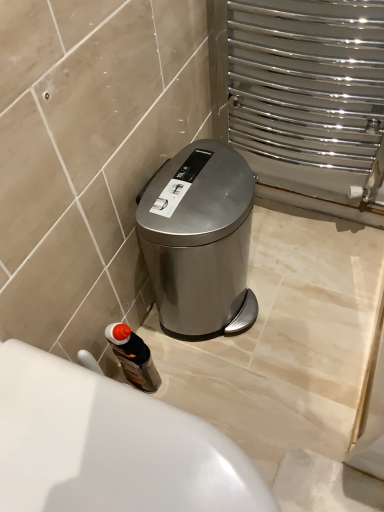
Question: Is white glossy bath at lower left next to satin silver trash can at center and touching it?

Choices:
 (A) no
 (B) yes

Answer: (A)

Question: From the image's perspective, is white glossy bath at lower left located beneath satin silver trash can at center?

Choices:
 (A) yes
 (B) no

Answer: (A)

Question: Is satin silver trash can at center inside white glossy bath at lower left?

Choices:
 (A) yes
 (B) no

Answer: (B)

Question: Is white glossy bath at lower left oriented away from satin silver trash can at center?

Choices:
 (A) yes
 (B) no

Answer: (B)

Question: Is white glossy bath at lower left completely or partially outside of satin silver trash can at center?

Choices:
 (A) yes
 (B) no

Answer: (A)

Question: Does white glossy bath at lower left have a lesser height compared to satin silver trash can at center?

Choices:
 (A) no
 (B) yes

Answer: (B)

Question: From a real-world perspective, is satin silver trash can at center below wooden textured bottle at lower left?

Choices:
 (A) no
 (B) yes

Answer: (A)

Question: Is satin silver trash can at center thinner than wooden textured bottle at lower left?

Choices:
 (A) no
 (B) yes

Answer: (A)

Question: Is satin silver trash can at center positioned far away from wooden textured bottle at lower left?

Choices:
 (A) yes
 (B) no

Answer: (B)

Question: Is satin silver trash can at center further to camera compared to wooden textured bottle at lower left?

Choices:
 (A) no
 (B) yes

Answer: (A)

Question: Does satin silver trash can at center touch wooden textured bottle at lower left?

Choices:
 (A) yes
 (B) no

Answer: (B)

Question: Would you say wooden textured bottle at lower left is part of satin silver trash can at center's contents?

Choices:
 (A) yes
 (B) no

Answer: (B)

Question: Is wooden textured bottle at lower left at the right side of satin silver trash can at center?

Choices:
 (A) yes
 (B) no

Answer: (B)